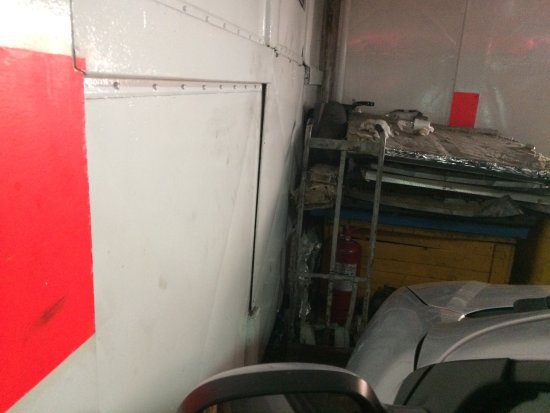
This screenshot has height=413, width=550. Find the location of `metal edging`. metal edging is located at coordinates (460, 161).